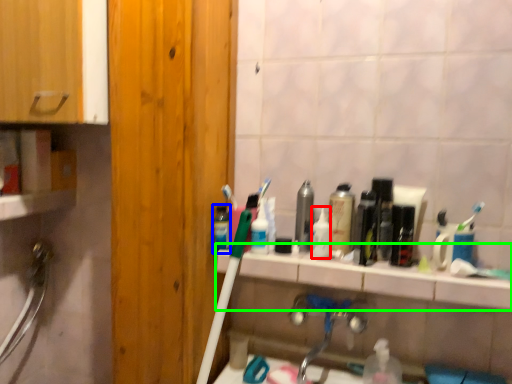
Question: Based on their relative distances, which object is nearer to toiletry (highlighted by a red box)? Choose from mouthwash (highlighted by a blue box) and counter top (highlighted by a green box).

Choices:
 (A) mouthwash
 (B) counter top

Answer: (B)